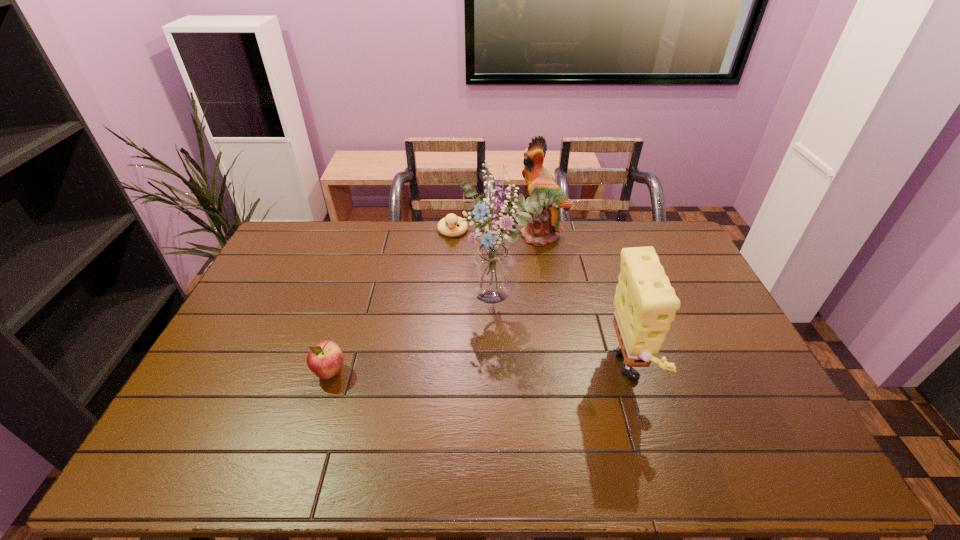
You are a GUI agent. You are given a task and a screenshot of the screen. Output one action in this format:
    pyautogui.click(x=<x>, y=<y>)
    Task: Click on the object positioned at the near edge
    
    Given the screenshot: What is the action you would take?
    pyautogui.click(x=645, y=303)

Locate an element on the screen. This screenshot has width=960, height=540. vacant region at the near edge of the desktop is located at coordinates pos(594,407).

The image size is (960, 540). Find the location of `free point at the left edge`. free point at the left edge is located at coordinates (269, 343).

At what (x,y) coordinates should I click in order to perform the action: click on free space at the right edge of the desktop. Please return your answer as a coordinate pair (x, y). Looking at the image, I should click on (727, 336).

Find the location of `vacant space at the far left corner of the desktop`. vacant space at the far left corner of the desktop is located at coordinates (301, 231).

Where is `vacant space at the far right corner of the desktop`? vacant space at the far right corner of the desktop is located at coordinates (676, 244).

Find the location of a particular element. The width and height of the screenshot is (960, 540). vacant space in between the third tallest object and the second tallest object is located at coordinates (588, 304).

You are a GUI agent. You are given a task and a screenshot of the screen. Output one action in this format:
    pyautogui.click(x=<x>, y=<y>)
    Task: Click on the free area in between the parrot and the leftmost object
    
    Given the screenshot: What is the action you would take?
    pyautogui.click(x=437, y=303)

Locate an element on the screen. free spot between the leftmost object and the shortest object is located at coordinates (392, 302).

This screenshot has width=960, height=540. Identify the location of vacant area that lies between the leftmost object and the rightmost object. (482, 373).